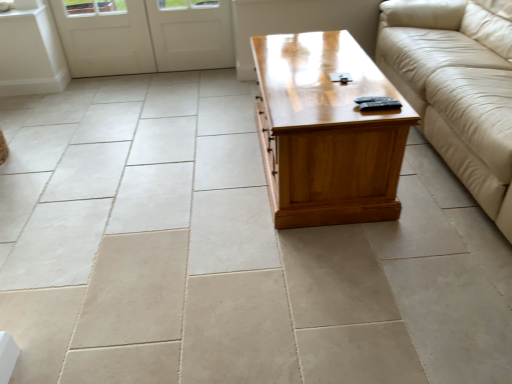
Find the location of `white matte door at upper left`. white matte door at upper left is located at coordinates (144, 35).

Where is `beige leather couch at right`? beige leather couch at right is located at coordinates (457, 88).

Locate an element on the screen. Image resolution: width=512 pixels, height=384 pixels. white matte door at upper left is located at coordinates (144, 35).

From a real-world perspective, which object stands above the other?

white matte door at upper left is physically above.

Between white matte door at upper left and light brown wood coffee table at center, which one has smaller size?

white matte door at upper left is smaller.

Which object is further away from the camera, white matte door at upper left or light brown wood coffee table at center?

white matte door at upper left is further away from the camera.

Does light brown wood coffee table at center turn towards beige leather couch at right?

No, light brown wood coffee table at center does not turn towards beige leather couch at right.

Would you say light brown wood coffee table at center is inside or outside beige leather couch at right?

light brown wood coffee table at center is not enclosed by beige leather couch at right.

Is light brown wood coffee table at center bigger than beige leather couch at right?

No.

Is point (328, 47) positioned behind point (410, 26)?

No.

Can you confirm if beige leather couch at right is shorter than light brown wood coffee table at center?

Incorrect, the height of beige leather couch at right does not fall short of that of light brown wood coffee table at center.

Considering the positions of points (435, 15) and (278, 63), is point (435, 15) farther from camera compared to point (278, 63)?

Yes, point (435, 15) is behind point (278, 63).

Find the location of `coffee table on the left of beige leather couch at right`. coffee table on the left of beige leather couch at right is located at coordinates (327, 131).

From the image's perspective, is beige leather couch at right beneath light brown wood coffee table at center?

No, from the image's perspective, beige leather couch at right is not below light brown wood coffee table at center.

Who is shorter, beige leather couch at right or white matte door at upper left?

With less height is white matte door at upper left.

Could you tell me if beige leather couch at right is facing white matte door at upper left?

Yes, beige leather couch at right is aimed at white matte door at upper left.

From a real-world perspective, is beige leather couch at right beneath white matte door at upper left?

No, from a real-world perspective, beige leather couch at right is not below white matte door at upper left.

Is beige leather couch at right thinner than white matte door at upper left?

In fact, beige leather couch at right might be wider than white matte door at upper left.

You are a GUI agent. You are given a task and a screenshot of the screen. Output one action in this format:
    pyautogui.click(x=<x>, y=<y>)
    Task: Click on the studio couch in front of the white matte door at upper left
    
    Given the screenshot: What is the action you would take?
    pyautogui.click(x=457, y=88)

Relative to beige leather couch at right, is white matte door at upper left in front or behind?

In the image, white matte door at upper left appears behind beige leather couch at right.

Can you confirm if white matte door at upper left is taller than beige leather couch at right?

No, white matte door at upper left is not taller than beige leather couch at right.

Is the depth of light brown wood coffee table at center greater than that of white matte door at upper left?

No, it is in front of white matte door at upper left.

Between point (300, 84) and point (153, 42), which one is positioned behind?

The point (153, 42) is more distant.

Is light brown wood coffee table at center oriented away from white matte door at upper left?

That's not correct — light brown wood coffee table at center is not looking away from white matte door at upper left.

In order to click on door that is above the light brown wood coffee table at center (from a real-world perspective) in this screenshot , I will do `click(144, 35)`.

Find the location of a particular element. The width and height of the screenshot is (512, 384). coffee table directly beneath the beige leather couch at right (from a real-world perspective) is located at coordinates (327, 131).

Estimate the real-world distances between objects in this image. Which object is further from beige leather couch at right, light brown wood coffee table at center or white matte door at upper left?

white matte door at upper left.

Based on their spatial positions, is white matte door at upper left or beige leather couch at right further from light brown wood coffee table at center?

white matte door at upper left is further to light brown wood coffee table at center.

From the picture: Estimate the real-world distances between objects in this image. Which object is further from white matte door at upper left, light brown wood coffee table at center or beige leather couch at right?

beige leather couch at right is positioned further to the anchor white matte door at upper left.

Based on their spatial positions, is white matte door at upper left or light brown wood coffee table at center further from beige leather couch at right?

Among the two, white matte door at upper left is located further to beige leather couch at right.

Considering their positions, is beige leather couch at right positioned further to white matte door at upper left than light brown wood coffee table at center?

Among the two, beige leather couch at right is located further to white matte door at upper left.

Considering their positions, is beige leather couch at right positioned closer to light brown wood coffee table at center than white matte door at upper left?

beige leather couch at right.

Find the location of a particular element. coffee table located between white matte door at upper left and beige leather couch at right in the left-right direction is located at coordinates (327, 131).